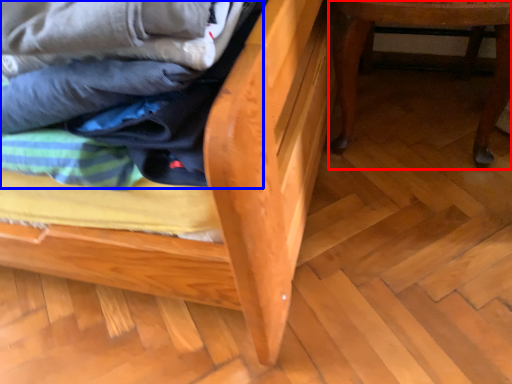
Question: Among these objects, which one is farthest to the camera, furniture (highlighted by a red box) or laundry (highlighted by a blue box)?

Choices:
 (A) furniture
 (B) laundry

Answer: (A)